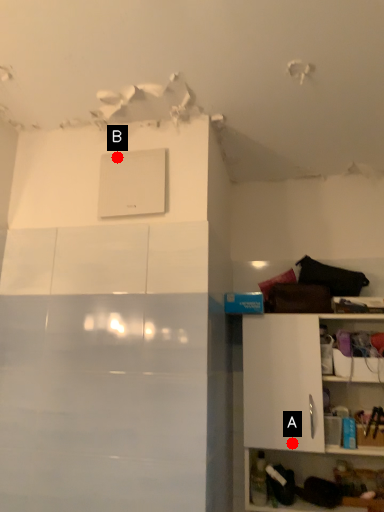
Question: Two points are circled on the image, labeled by A and B beside each circle. Which of the following is the farthest from the observer?

Choices:
 (A) A is further
 (B) B is further

Answer: (A)